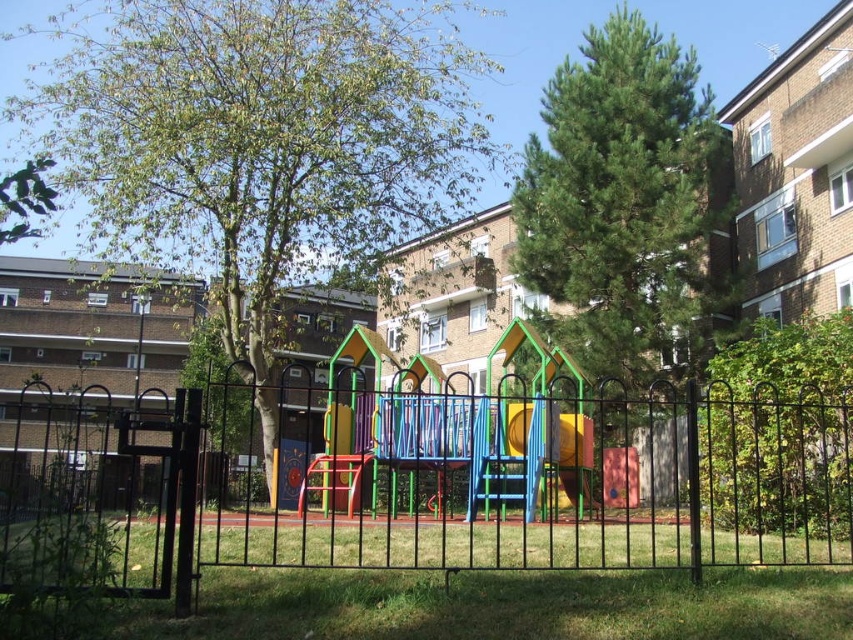
You are a parent trying to decide where to place a new picnic blanket in the playground. You want to ensure there is enough space between the green leafy tree at center and the multicolored plastic slide at center for the blanket. Can you determine if the area between them is wide enough for a standard picnic blanket that is 1.5 meters wide?

The green leafy tree at center is larger in size than the multicolored plastic slide at center, but the exact distance between them is not specified. Therefore, it is uncertain whether the space between them is wide enough for a 1.5 meter picnic blanket.

You are a parent trying to decide where to place a new picnic blanket in the playground. You want to ensure it is under the shade of the tallest tree available. Based on the image, which tree should you choose between the green leafy tree at center and the green textured pine tree at upper right?

The green leafy tree at center is much taller than the green textured pine tree at upper right, so you should place the picnic blanket under the shade of the green leafy tree at center.

You are a parent trying to ensure your child can safely play on the multicolored plastic slide at center while staying within the fenced area. Given the green leafy tree at center is above it, could the tree pose a safety risk if the child were to climb onto the slide?

The green leafy tree at center is located above the multicolored plastic slide at center, so there is a potential safety risk if the child were to climb onto the slide because branches could obstruct movement or pose a falling hazard.